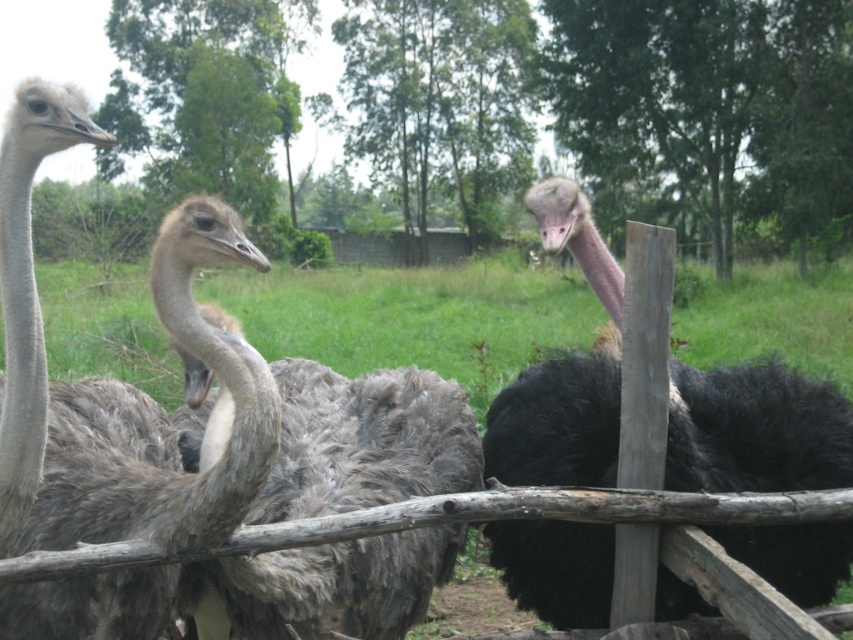
You are standing in front of the enclosure and want to touch the ostriches. Which ostrich, the gray feathered ostrich at left or the black feathered ostrich at center, can you reach first without moving your position?

The gray feathered ostrich at left is closer to the viewer than the black feathered ostrich at center, so you can reach the gray feathered ostrich at left first without moving.

You are a farmer who wants to identify the tallest ostrich in the enclosure. You see the gray feathered ostrich at left and the black feathered ostrich at center. Which one is taller?

The gray feathered ostrich at left is taller than the black feathered ostrich at center.

You are standing at the origin point of the image. Which direction should you move to locate the gray feathered ostrich at left?

To locate the gray feathered ostrich at left, you should move towards the left side of the image since it is positioned at point 0.608 on the x and 0.129 on the y coordinates.